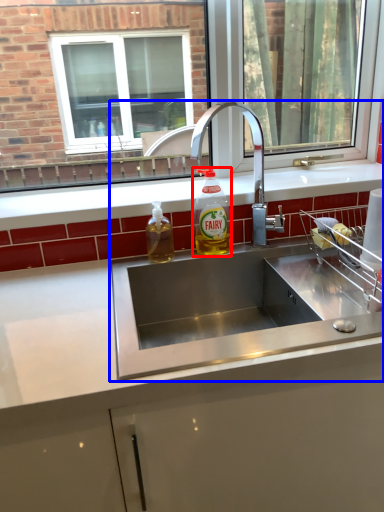
Question: Which of the following is the farthest to the observer, bottle (highlighted by a red box) or sink (highlighted by a blue box)?

Choices:
 (A) bottle
 (B) sink

Answer: (A)